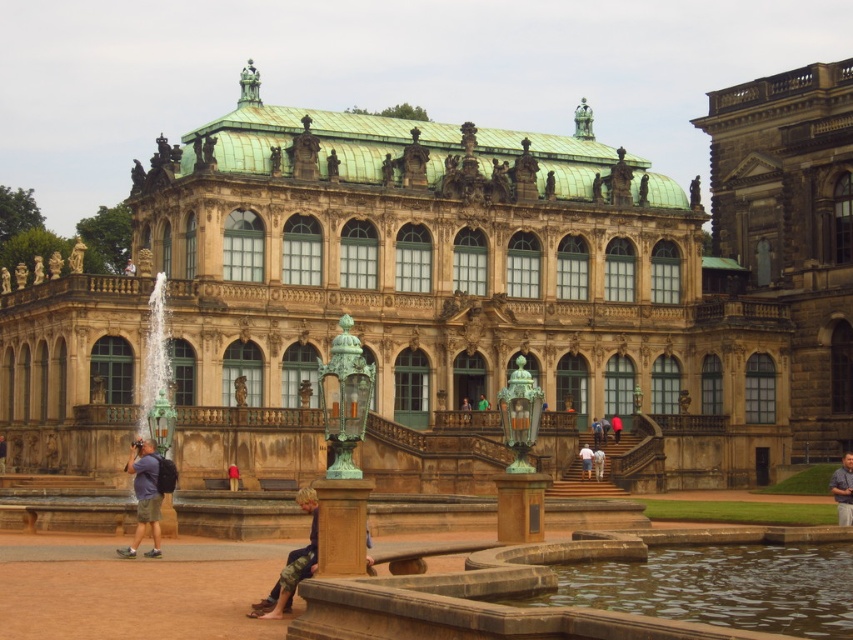
Question: Does sandy stone column at center come in front of white cotton shirt at center?

Choices:
 (A) no
 (B) yes

Answer: (B)

Question: Can you confirm if brown leather jacket at lower center is positioned above red fabric person at center?

Choices:
 (A) no
 (B) yes

Answer: (A)

Question: Which of the following is the farthest from the observer?

Choices:
 (A) green fabric shirt at center
 (B) green patinated metal at center
 (C) red fabric person at center
 (D) brown leather jacket at lower center

Answer: (C)

Question: Which object is the closest to the pink fabric pants at center?

Choices:
 (A) sandy stone column at center
 (B) gray shirt at lower right

Answer: (B)

Question: Which of the following is the farthest from the observer?

Choices:
 (A) (137, 486)
 (B) (1, 467)
 (C) (613, 413)

Answer: (C)

Question: Can you confirm if green patinated metal at center is positioned below green fabric shirt at center?

Choices:
 (A) yes
 (B) no

Answer: (A)